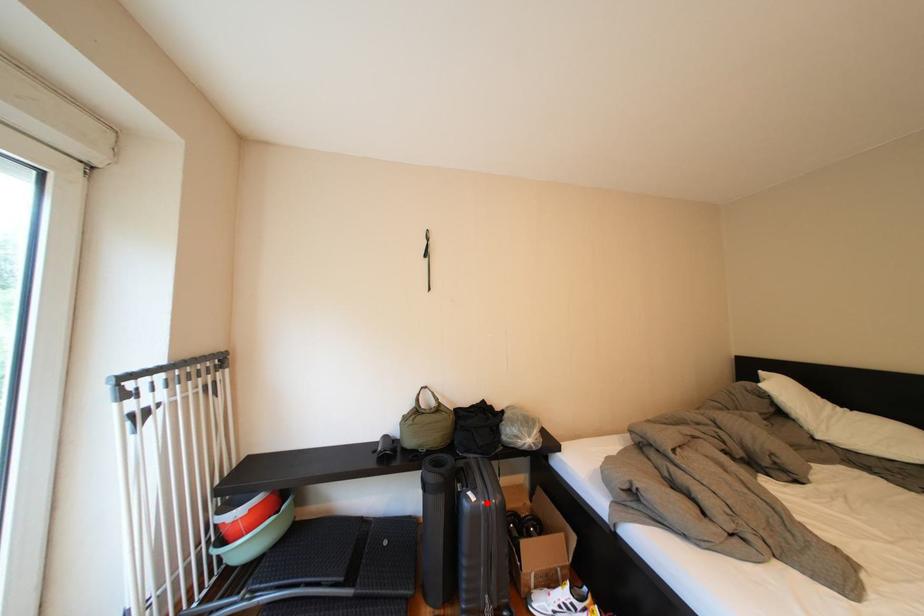
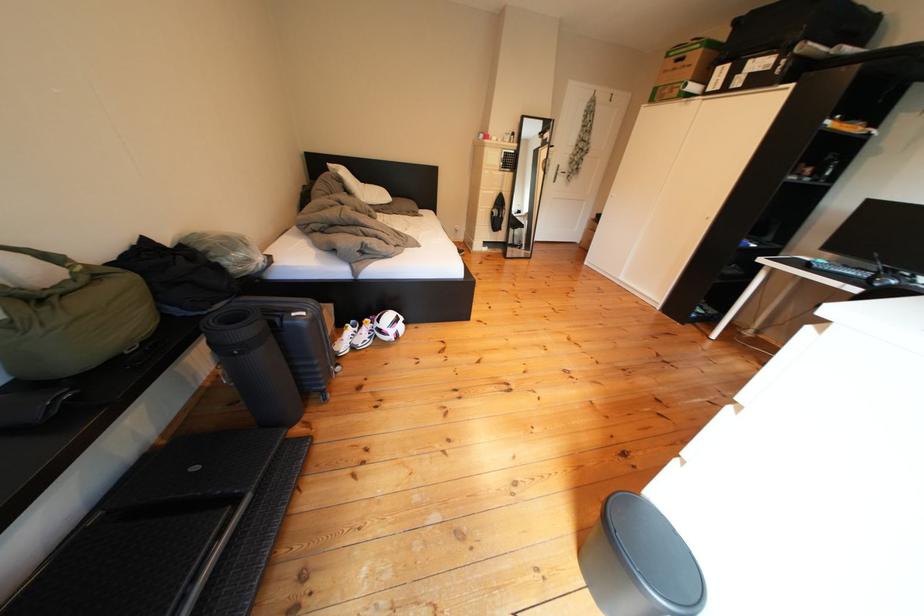
Find the pixel in the second image that matches the highlighted location in the first image.

(317, 318)